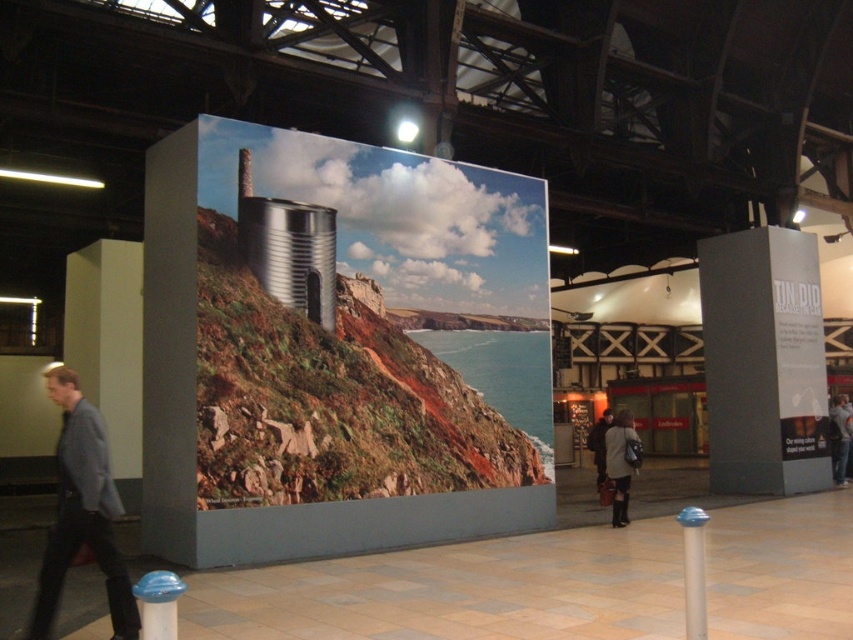
Can you confirm if metallic silver tank at center is wider than dark gray coat at center?

Answer: In fact, metallic silver tank at center might be narrower than dark gray coat at center.

Can you confirm if metallic silver tank at center is thinner than dark gray coat at center?

Indeed, metallic silver tank at center has a lesser width compared to dark gray coat at center.

Describe the element at coordinates (364, 321) in the screenshot. The image size is (853, 640). I see `metallic silver tank at center` at that location.

Locate an element on the screen. metallic silver tank at center is located at coordinates (364, 321).

Is translucent plastic pillar at center above dark gray coat at center?

Correct, translucent plastic pillar at center is located above dark gray coat at center.

Which is more to the left, translucent plastic pillar at center or dark gray coat at center?

Positioned to the left is translucent plastic pillar at center.

Who is more forward, (692, 616) or (619, 486)?

Point (692, 616) is more forward.

Find the location of `translucent plastic pillar at center`. translucent plastic pillar at center is located at coordinates (693, 570).

Does black glossy sign at right have a greater width compared to gray fabric jacket at center?

Yes.

Can you confirm if black glossy sign at right is positioned below gray fabric jacket at center?

No, black glossy sign at right is not below gray fabric jacket at center.

Find the location of a particular element. Image resolution: width=853 pixels, height=640 pixels. black glossy sign at right is located at coordinates (763, 362).